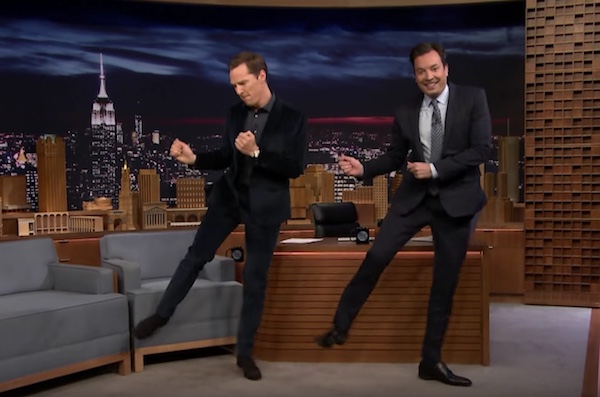
You are a GUI agent. You are given a task and a screenshot of the screen. Output one action in this format:
    pyautogui.click(x=<x>, y=<y>)
    Task: Click on the black chair
    The height and width of the screenshot is (397, 600).
    Given the screenshot: What is the action you would take?
    pyautogui.click(x=323, y=216)